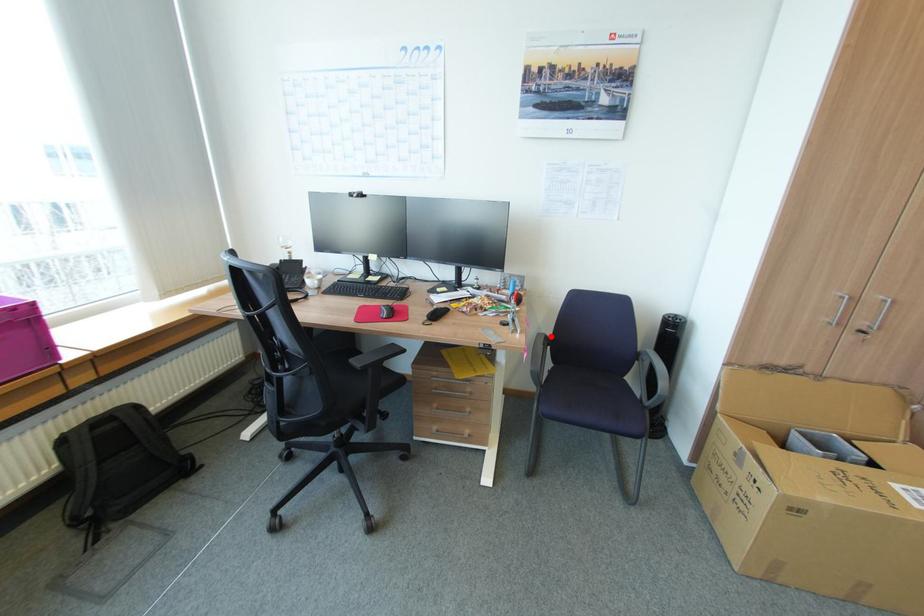
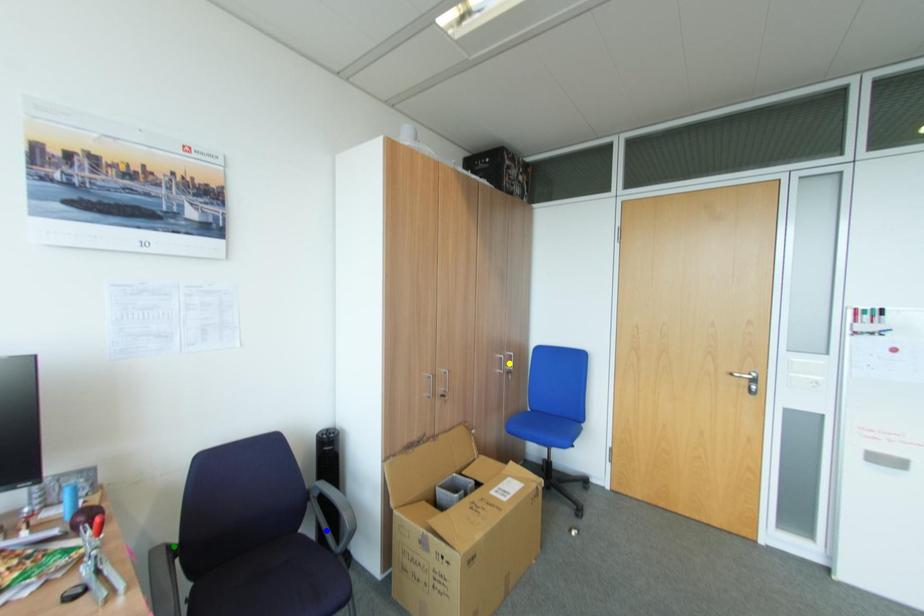
Question: I am providing you with two images of the same scene from different viewpoints. A red point is marked on the first image. You are given multiple points on the second image. Which point in image 2 represents the same 3d spot as the red point in image 1?

Choices:
 (A) blue point
 (B) green point
 (C) yellow point

Answer: (B)